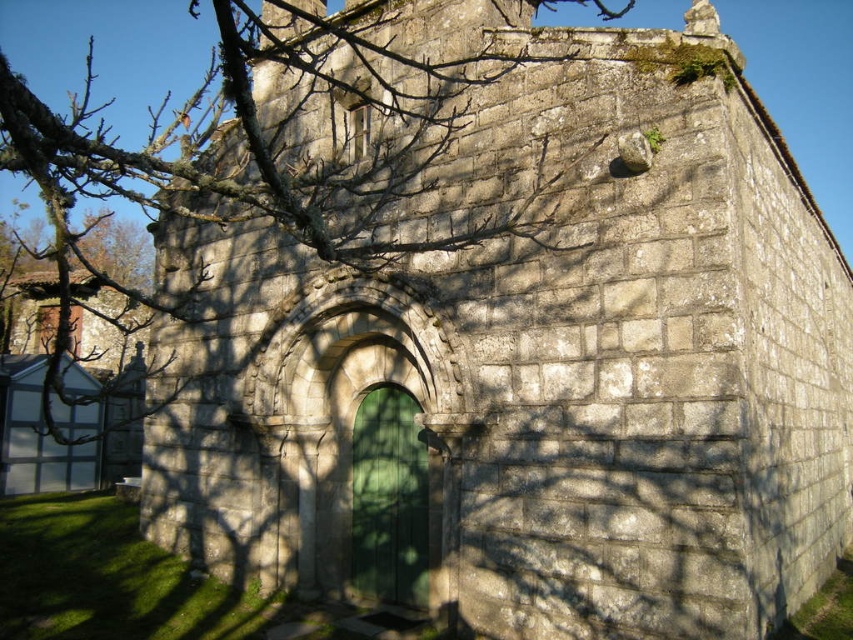
You are standing at the entrance of the stone building and see two points marked on the ground. One is labeled as point (368, 221) and the other as point (396, 516). Which point is closer to you?

Point (368, 221) is in front of point (396, 516), so it is closer to you.

From the picture: You are standing in front of the stone building and notice two elements in the image. The first is the bare branches at upper left, and the second is the green wooden door at center. Which of these two elements is located to the left of the other?

The bare branches at upper left is positioned on the left side of green wooden door at center.

You are standing in front of the stone building and notice the bare branches at upper left and the green wooden door at center. Which object has a greater width?

The bare branches at upper left have a greater width than the green wooden door at center.